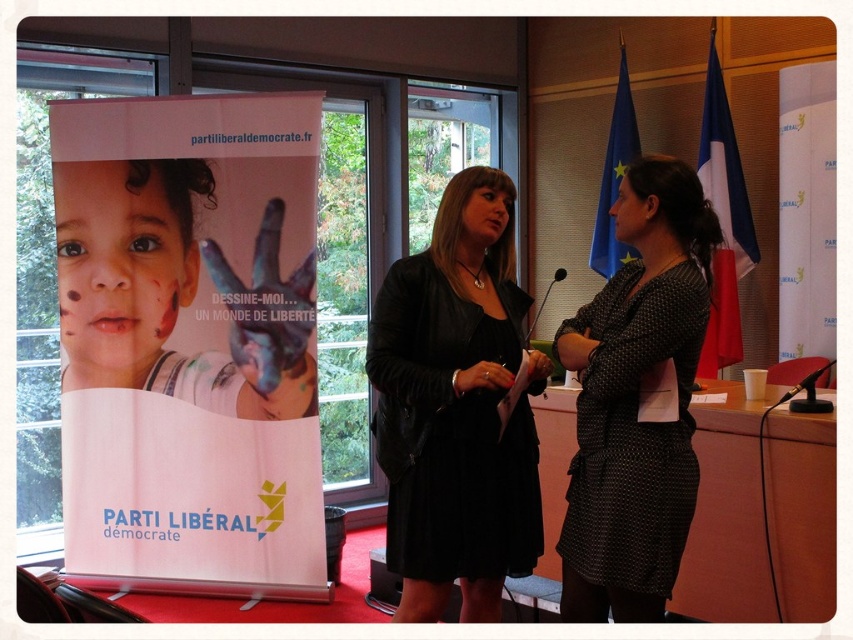
You are attending a formal event and notice two items displayed in the scene. Which object, the white paper poster at left or the blue fabric flag at upper right, is positioned higher up in the image?

The blue fabric flag at upper right is positioned higher up in the image than the white paper poster at left.

You are a photographer standing at the camera position. You want to take a photo of the white paper poster at left without including the two women in the frame. Is the distance between you and the poster sufficient to allow you to zoom in closely on it while keeping the women out of the shot?

The white paper poster at left is 3.39 meters from the camera. Since the women are closer to the camera than the poster, you can zoom in on the poster while keeping the women out of the shot by focusing on the poster at that distance.

You are attending a formal event and notice two blue fabric flags in the background. Which flag is closer to the ground, the blue fabric flag at right or the blue fabric flag at upper right?

The blue fabric flag at right is positioned under the blue fabric flag at upper right, so it is closer to the ground.